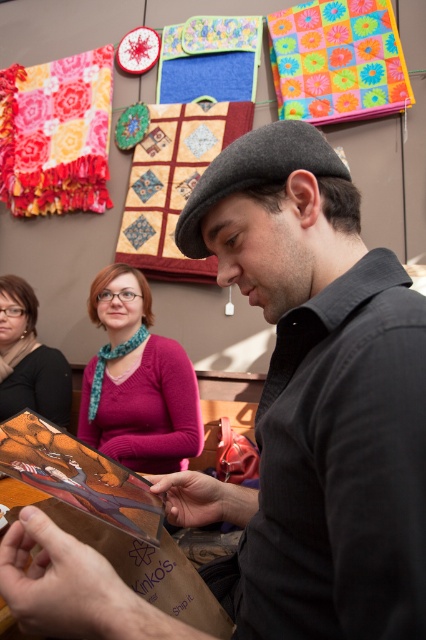
What do you see at coordinates (210, 60) in the screenshot? The image size is (426, 640). I see `blue felt pouch at upper center` at bounding box center [210, 60].

Is point (221, 72) behind point (51, 387)?

Yes, it is.

The height and width of the screenshot is (640, 426). I want to click on blue felt pouch at upper center, so click(x=210, y=60).

From the picture: Does floral fabric quilt at upper right have a lesser width compared to matte pink sweater at center?

Incorrect, floral fabric quilt at upper right's width is not less than matte pink sweater at center's.

In the scene shown: Between floral fabric quilt at upper right and matte pink sweater at center, which one appears on the right side from the viewer's perspective?

floral fabric quilt at upper right is more to the right.

The height and width of the screenshot is (640, 426). Describe the element at coordinates (337, 60) in the screenshot. I see `floral fabric quilt at upper right` at that location.

Locate an element on the screen. floral fabric quilt at upper right is located at coordinates (337, 60).

Is gray wool beret at center to the left of blue felt pouch at upper center from the viewer's perspective?

Incorrect, gray wool beret at center is not on the left side of blue felt pouch at upper center.

Is gray wool beret at center further to the viewer compared to blue felt pouch at upper center?

No, gray wool beret at center is in front of blue felt pouch at upper center.

In order to click on gray wool beret at center in this screenshot , I will do `click(256, 173)`.

Where is `gray wool beret at center`? gray wool beret at center is located at coordinates (256, 173).